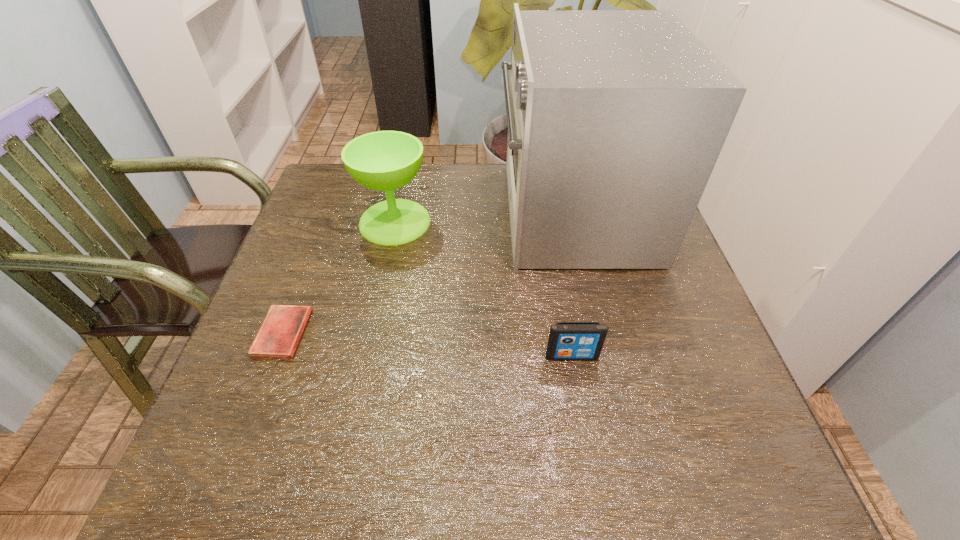
Where is `the tallest object`? the tallest object is located at coordinates pos(616,118).

Locate an element on the screen. The height and width of the screenshot is (540, 960). wineglass is located at coordinates (385, 161).

Where is `the third shortest object`? The image size is (960, 540). the third shortest object is located at coordinates (385, 161).

The image size is (960, 540). Find the location of `the second shortest object`. the second shortest object is located at coordinates (567, 340).

Image resolution: width=960 pixels, height=540 pixels. What are the coordinates of `the shortest object` in the screenshot? It's located at (280, 332).

You are a GUI agent. You are given a task and a screenshot of the screen. Output one action in this format:
    pyautogui.click(x=<x>, y=<y>)
    Task: Click on the diary
    
    Given the screenshot: What is the action you would take?
    pyautogui.click(x=280, y=332)

Locate an element on the screen. free space located on the front panel of the toaster oven is located at coordinates [345, 214].

Find the location of a particular element. The height and width of the screenshot is (540, 960). vacant region located 0.260m on the front panel of the toaster oven is located at coordinates (399, 214).

The image size is (960, 540). Find the location of `free region located on the front panel of the toaster oven`. free region located on the front panel of the toaster oven is located at coordinates click(x=426, y=214).

Identify the location of blank area located on the right of the wineglass. The height and width of the screenshot is (540, 960). (450, 222).